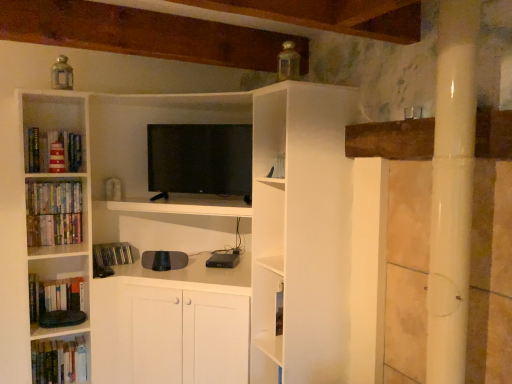
Identify the location of free point below hardcover books at left, which appears as the second book when viewed from the top (from a real-world perspective). This screenshot has height=384, width=512. (50, 217).